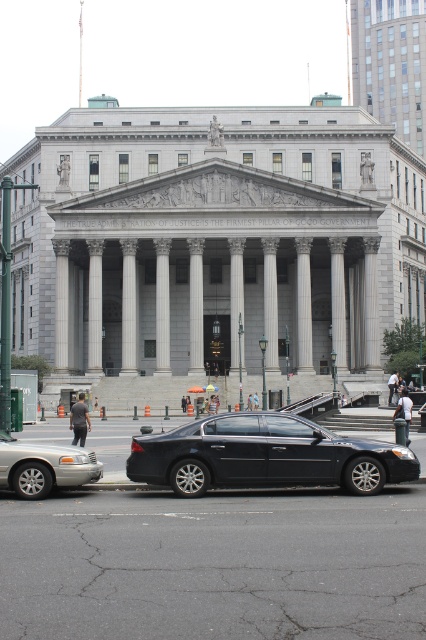
You are a visitor arriving at the courthouse and need to park your car. You see a shiny black sedan at center and a silver metallic sedan at lower left. Which parking spot is closer to the entrance?

The silver metallic sedan at lower left is closer to the entrance because the shiny black sedan at center is located above it, meaning it is parked farther away from the entrance.

You are a photographer planning to take a picture of the grand neoclassical building. You have two cars in the scene, the shiny black sedan at center and the silver metallic sedan at lower left. Which car should you avoid framing too closely to the building to maintain the focus on the architecture?

The shiny black sedan at center is larger in size than the silver metallic sedan at lower left, so you should avoid framing the shiny black sedan at center too closely to the building to keep the focus on the architecture.